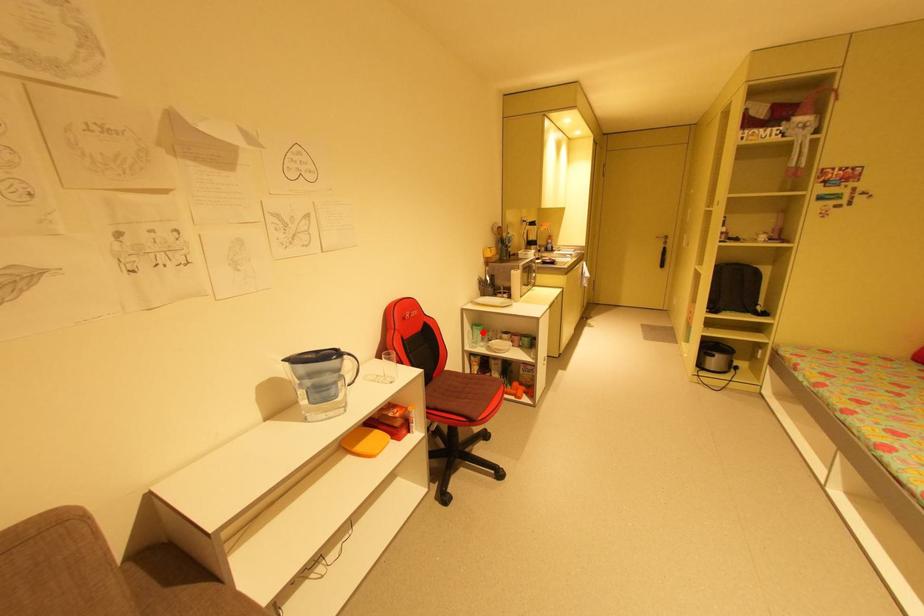
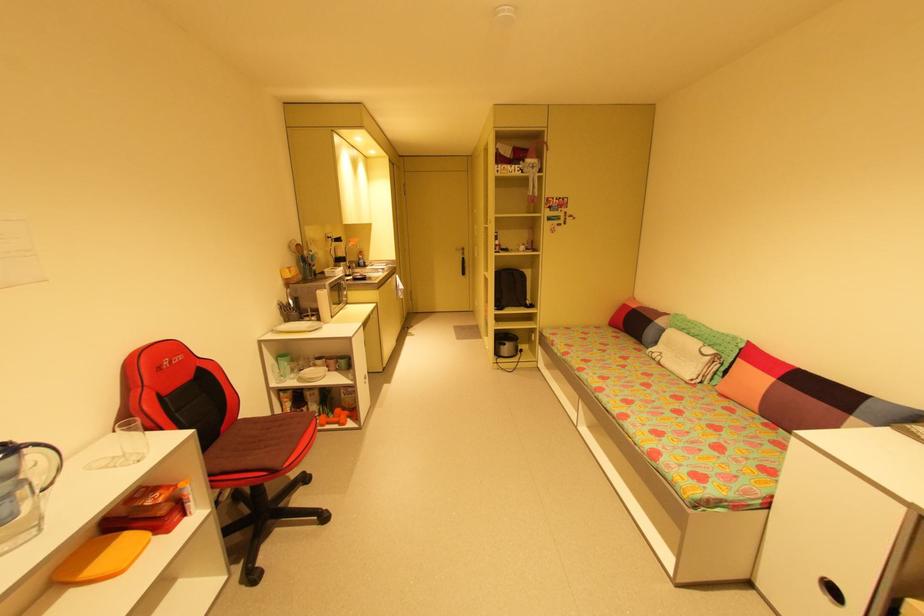
Locate, in the second image, the point that corresponds to the highlighted location in the first image.

(290, 363)